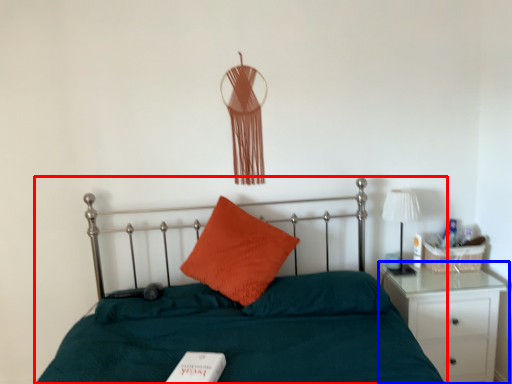
Question: Which object is further to the camera taking this photo, bed (highlighted by a red box) or nightstand (highlighted by a blue box)?

Choices:
 (A) bed
 (B) nightstand

Answer: (B)